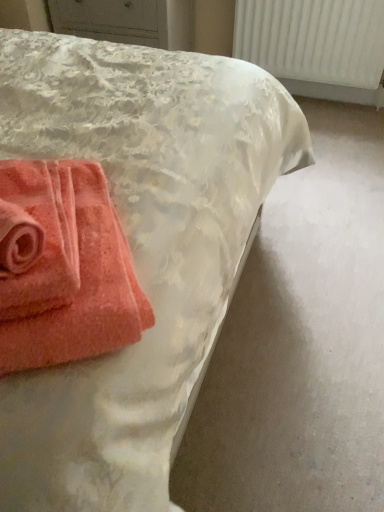
Question: Does white textured radiator at upper right contain coral terry cloth towel at lower left, marked as the first towel in a right-to-left arrangement?

Choices:
 (A) no
 (B) yes

Answer: (A)

Question: Is white textured radiator at upper right shorter than coral terry cloth towel at lower left, marked as the first towel in a right-to-left arrangement?

Choices:
 (A) yes
 (B) no

Answer: (B)

Question: Is white textured radiator at upper right wider than coral terry cloth towel at lower left, marked as the first towel in a right-to-left arrangement?

Choices:
 (A) no
 (B) yes

Answer: (A)

Question: Is the depth of white textured radiator at upper right less than that of coral terry cloth towel at lower left, the 2th towel from the left?

Choices:
 (A) yes
 (B) no

Answer: (B)

Question: Is white textured radiator at upper right next to coral terry cloth towel at lower left, marked as the first towel in a right-to-left arrangement?

Choices:
 (A) no
 (B) yes

Answer: (A)

Question: Can you confirm if white textured radiator at upper right is positioned to the right of coral terry cloth towel at lower left, marked as the first towel in a right-to-left arrangement?

Choices:
 (A) no
 (B) yes

Answer: (B)

Question: Considering the relative sizes of coral terry cloth towel at lower left, the 2th towel from the left, and white textured radiator at upper right in the image provided, is coral terry cloth towel at lower left, the 2th towel from the left, smaller than white textured radiator at upper right?

Choices:
 (A) yes
 (B) no

Answer: (A)

Question: Is coral terry cloth towel at lower left, marked as the first towel in a right-to-left arrangement, shorter than white textured radiator at upper right?

Choices:
 (A) no
 (B) yes

Answer: (B)

Question: Is coral terry cloth towel at lower left, marked as the first towel in a right-to-left arrangement, oriented towards white textured radiator at upper right?

Choices:
 (A) no
 (B) yes

Answer: (A)

Question: Is coral terry cloth towel at lower left, marked as the first towel in a right-to-left arrangement, to the right of white textured radiator at upper right from the viewer's perspective?

Choices:
 (A) yes
 (B) no

Answer: (B)

Question: Is coral terry cloth towel at lower left, marked as the first towel in a right-to-left arrangement, touching white textured radiator at upper right?

Choices:
 (A) no
 (B) yes

Answer: (A)

Question: Is the position of coral terry cloth towel at lower left, marked as the first towel in a right-to-left arrangement, more distant than that of white textured radiator at upper right?

Choices:
 (A) no
 (B) yes

Answer: (A)

Question: Does coral soft towel at lower left, positioned as the 2th towel in right-to-left order, lie behind white textured radiator at upper right?

Choices:
 (A) yes
 (B) no

Answer: (B)